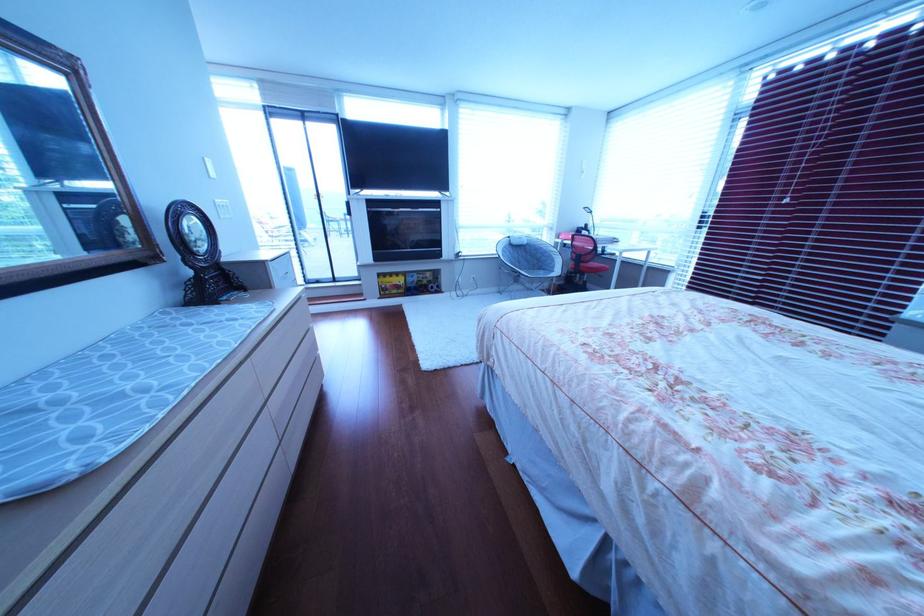
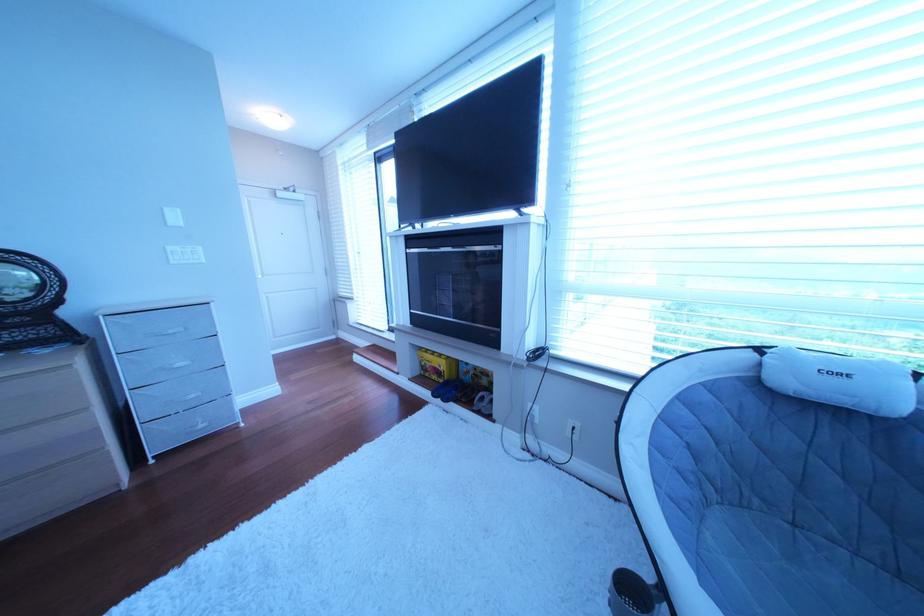
Where in the second image is the point corresponding to point (219, 161) from the first image?

(177, 211)